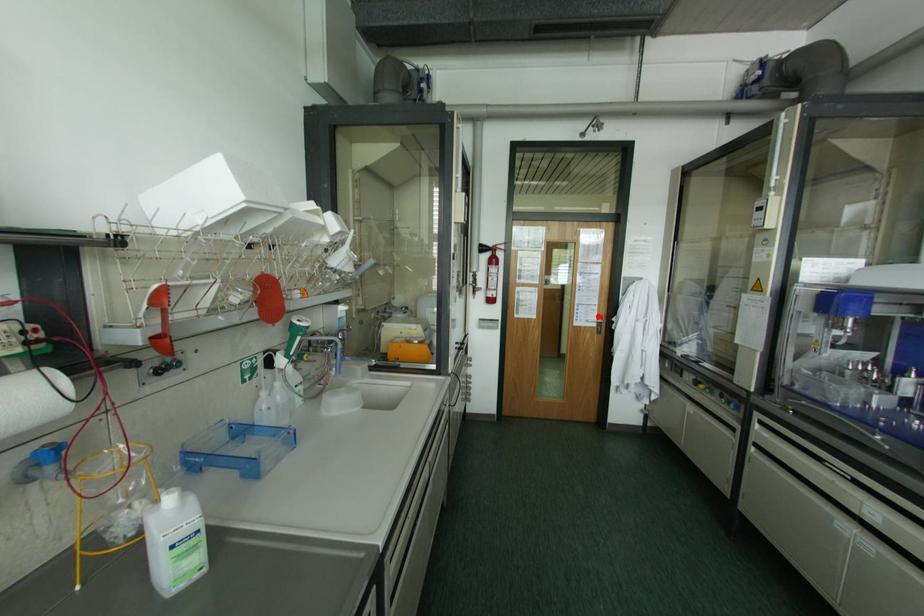
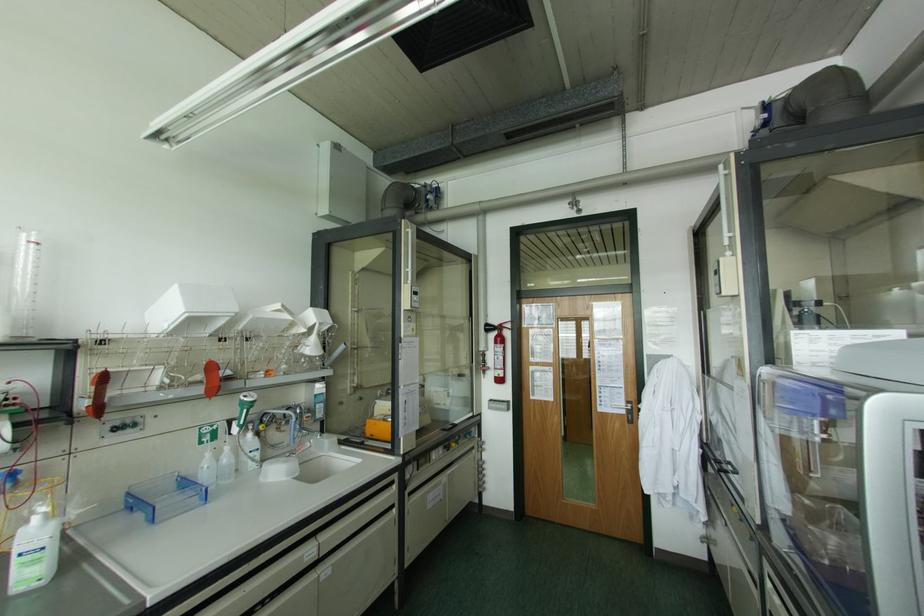
In the second image, find the point that corresponds to the highlighted location in the first image.

(626, 400)